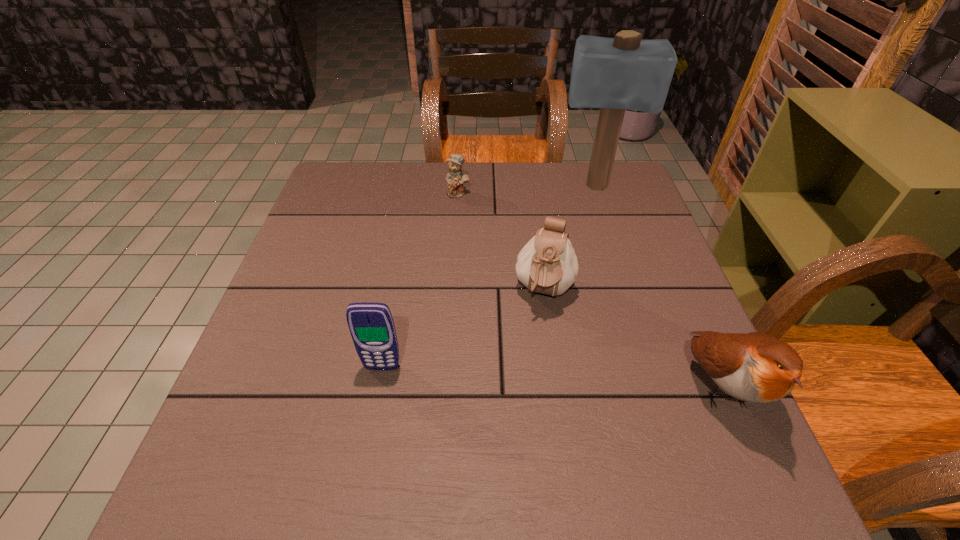
Locate which object ranks second in proximity to the tallest object. Please provide its 2D coordinates. Your answer should be formatted as a tuple, i.e. [(x, y)], where the tuple contains the x and y coordinates of a point satisfying the conditions above.

[(547, 264)]

What are the coordinates of `free point that satisfies the following two spatial constraints: 1. on the back side of the mallet; 2. on the left side of the third nearest object` in the screenshot? It's located at (530, 187).